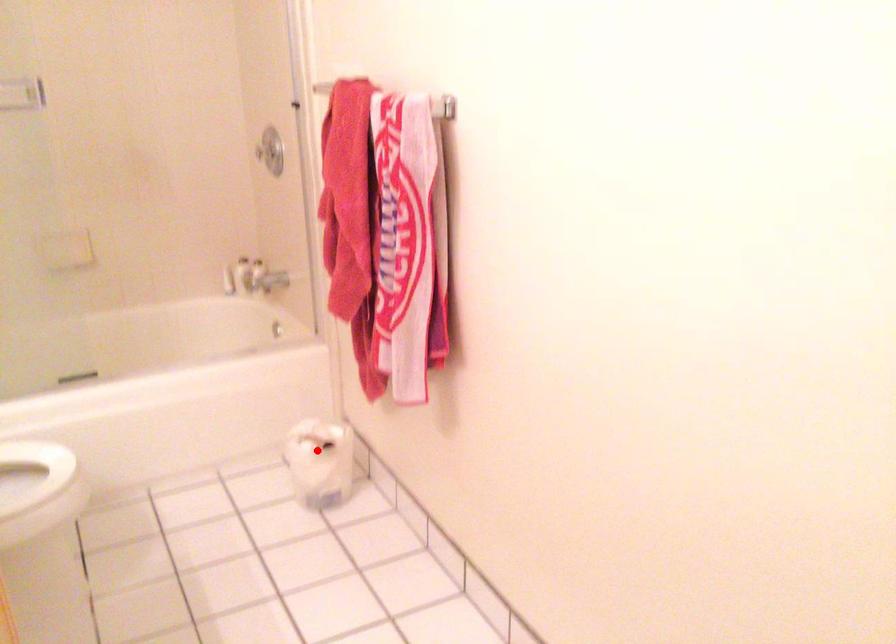
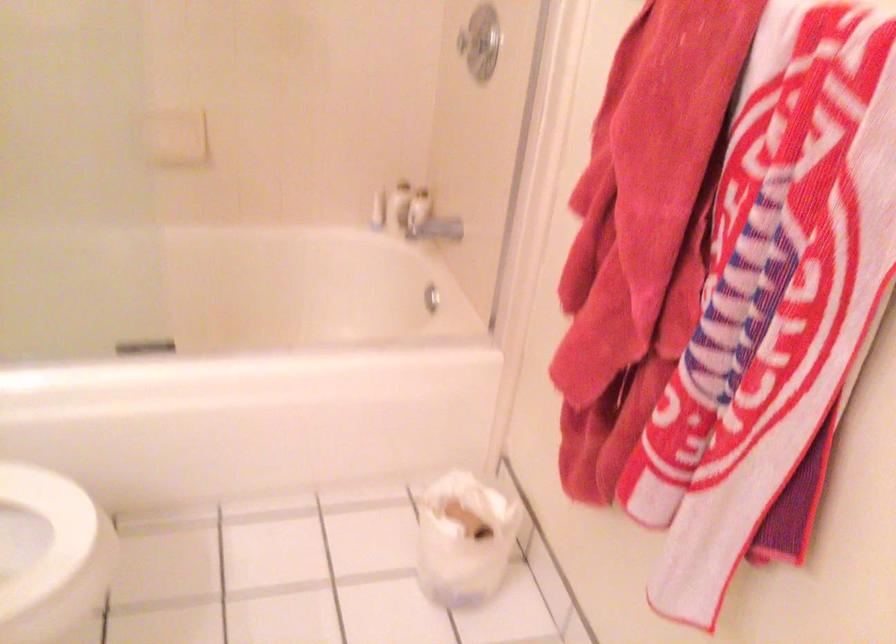
In the second image, find the point that corresponds to the highlighted location in the first image.

(464, 538)